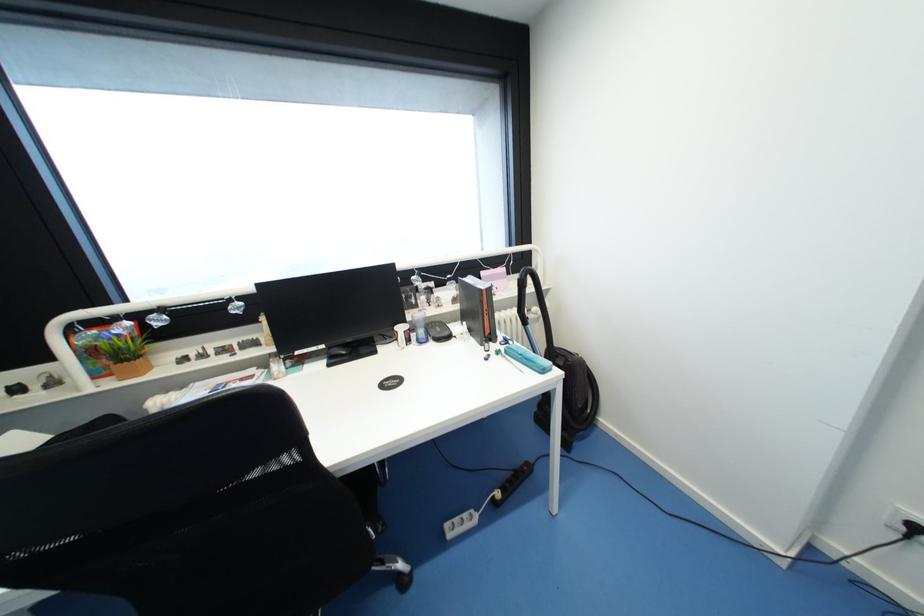
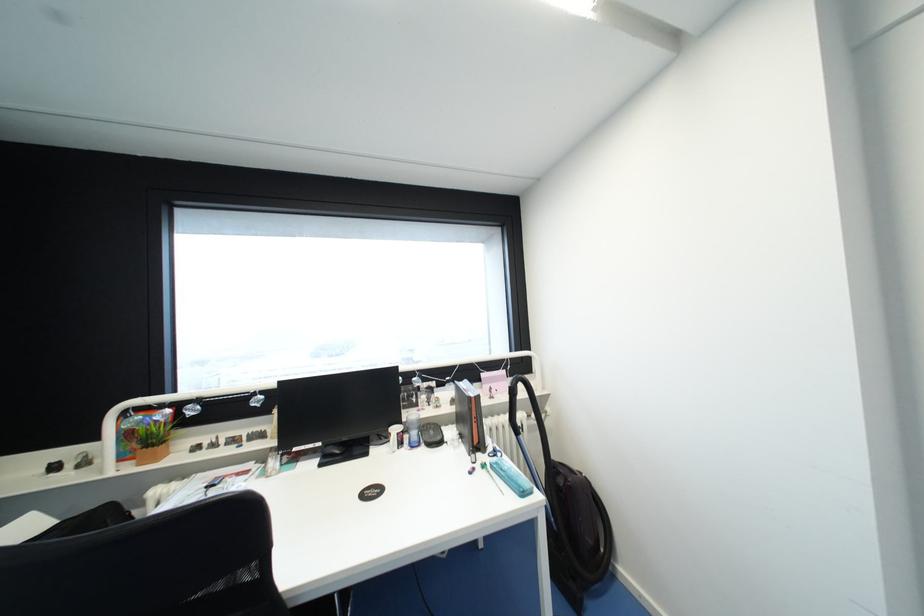
Locate, in the second image, the point that corresponds to point (327, 347) in the first image.

(323, 445)